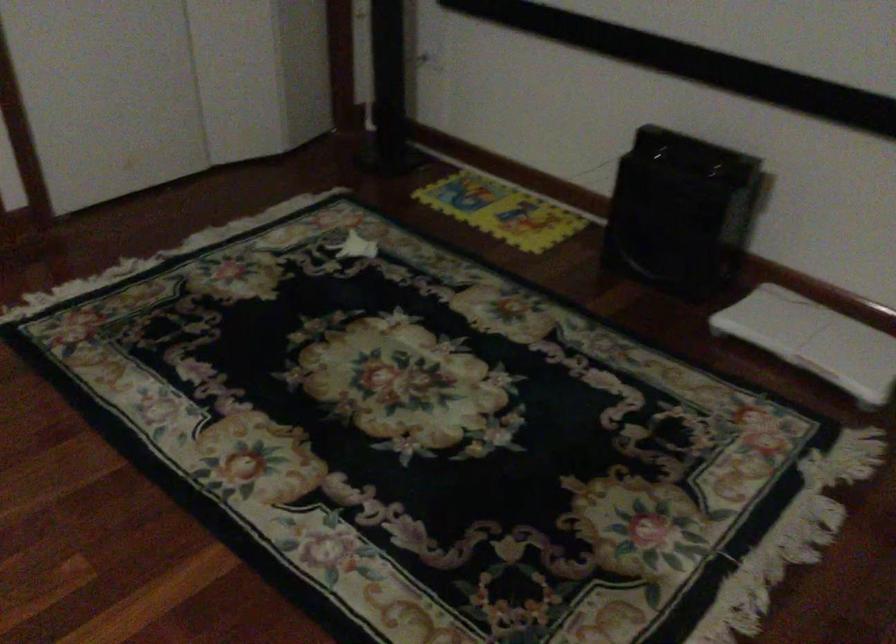
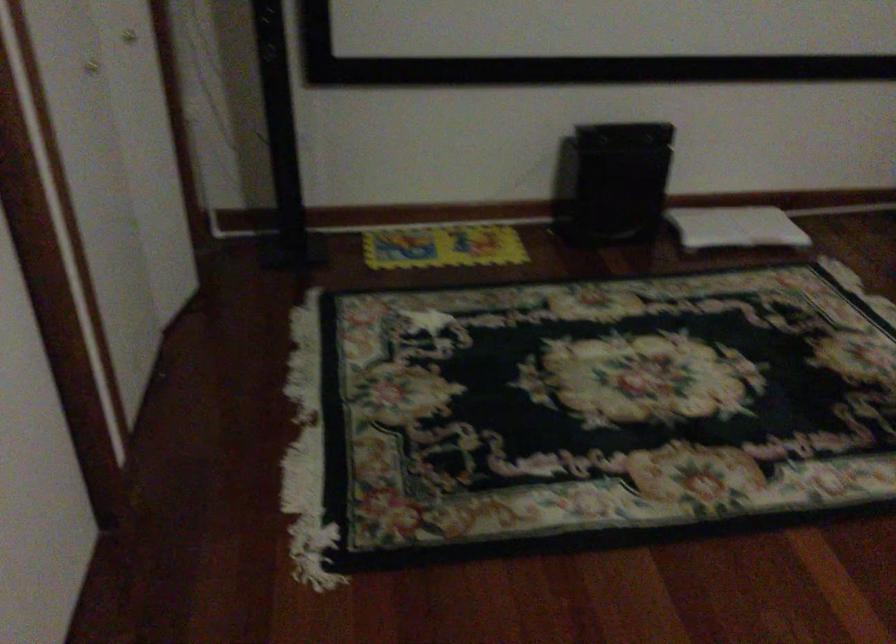
In the second image, find the point that corresponds to point (778, 335) in the first image.

(735, 227)